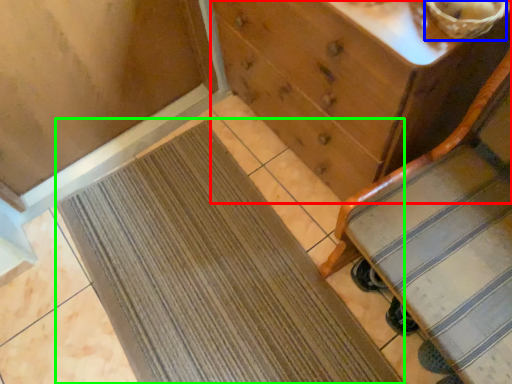
Question: Based on their relative distances, which object is farther from chest of drawers (highlighted by a red box)? Choose from basket (highlighted by a blue box) and doormat (highlighted by a green box).

Choices:
 (A) basket
 (B) doormat

Answer: (B)